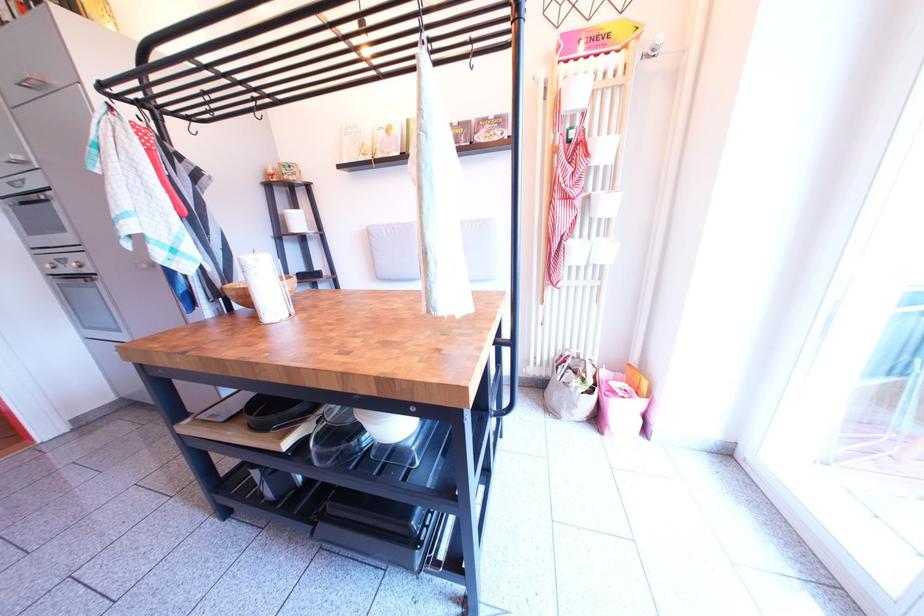
Where would you pull the silver oven handle? Please return your answer as a coordinate pair (x, y).

(79, 264)